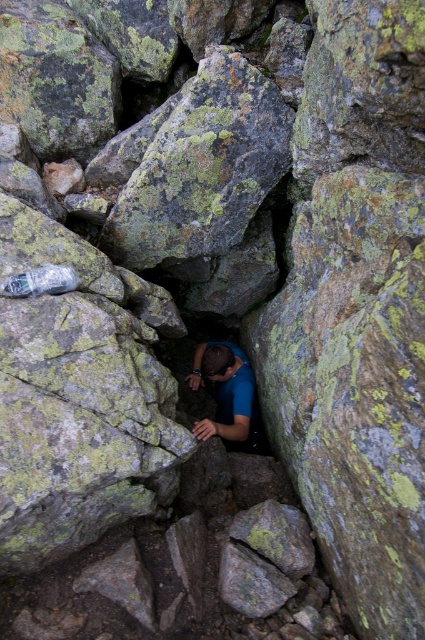
You are an explorer in the rocky terrain. You see the blue fabric at center and the transparent plastic bottle at lower left. How far apart are these two items?

The blue fabric at center and transparent plastic bottle at lower left are 4.76 feet apart.

You are a hiker who has just found a blue fabric at center and a transparent plastic bottle at lower left in a rocky area. Which item is positioned higher up in the scene?

The transparent plastic bottle at lower left is higher up than the blue fabric at center.